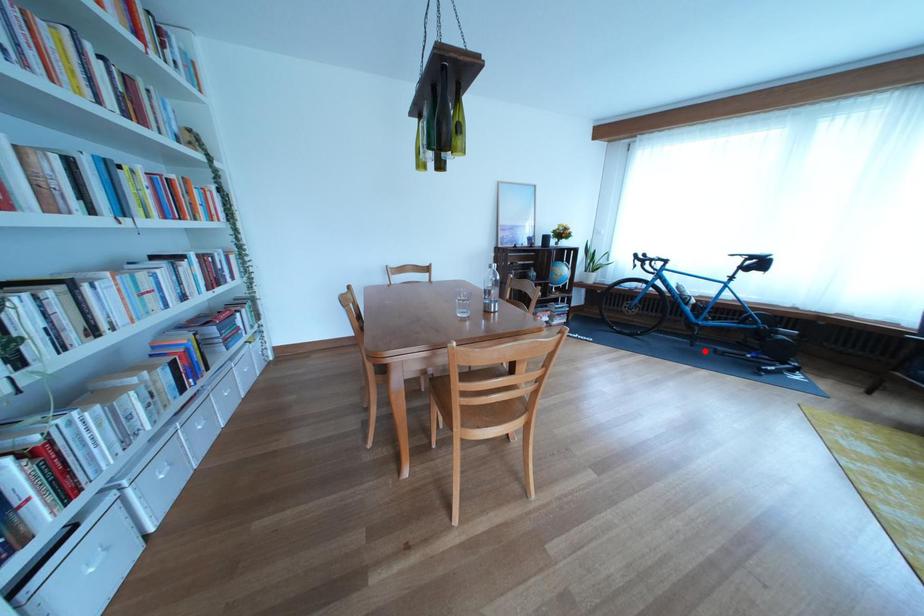
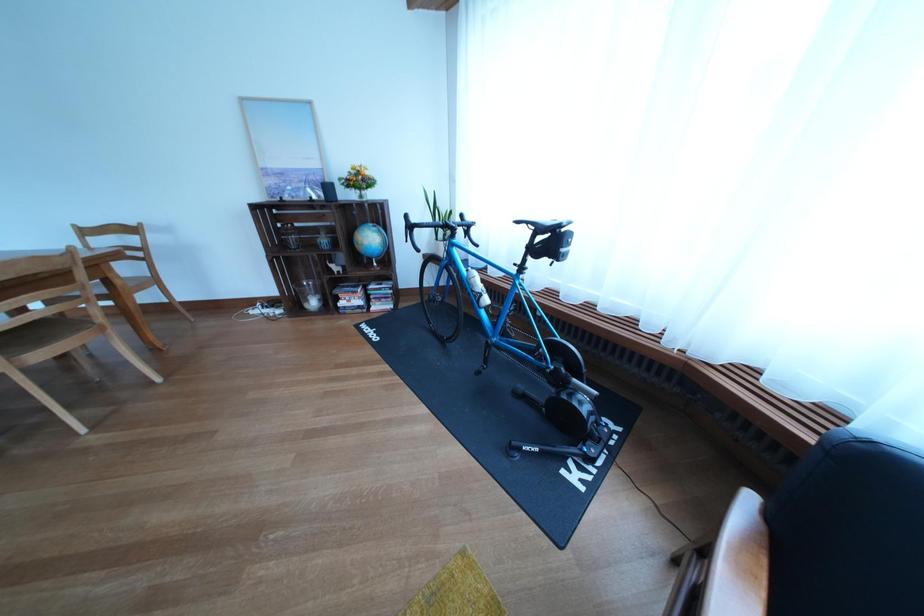
Question: A red point is marked in image1. In image2, is the corresponding 3D point closer to the camera or farther? Reply with the corresponding letter.

Choices:
 (A) The corresponding 3D point is closer.
 (B) The corresponding 3D point is farther.

Answer: (B)